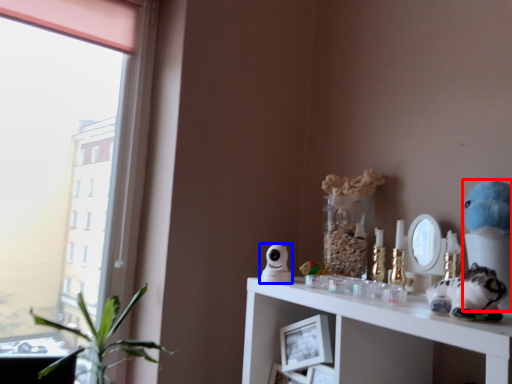
Question: Which point is closer to the camera, figurine (highlighted by a red box) or figurine (highlighted by a blue box)?

Choices:
 (A) figurine
 (B) figurine

Answer: (A)